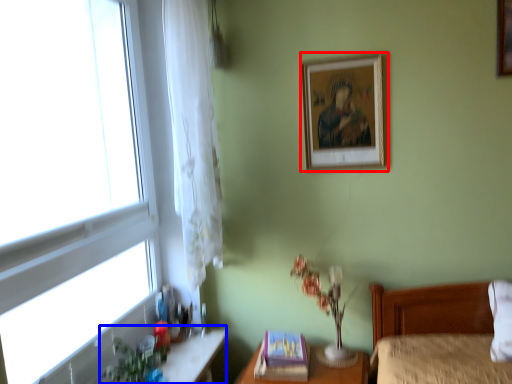
Question: Which point is further to the camera, picture frame (highlighted by a red box) or vanity (highlighted by a blue box)?

Choices:
 (A) picture frame
 (B) vanity

Answer: (A)